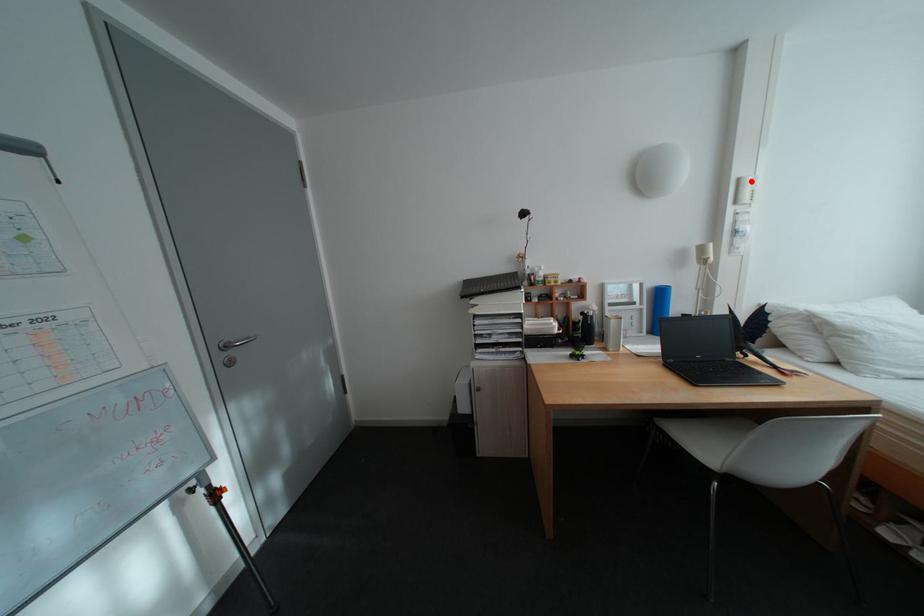
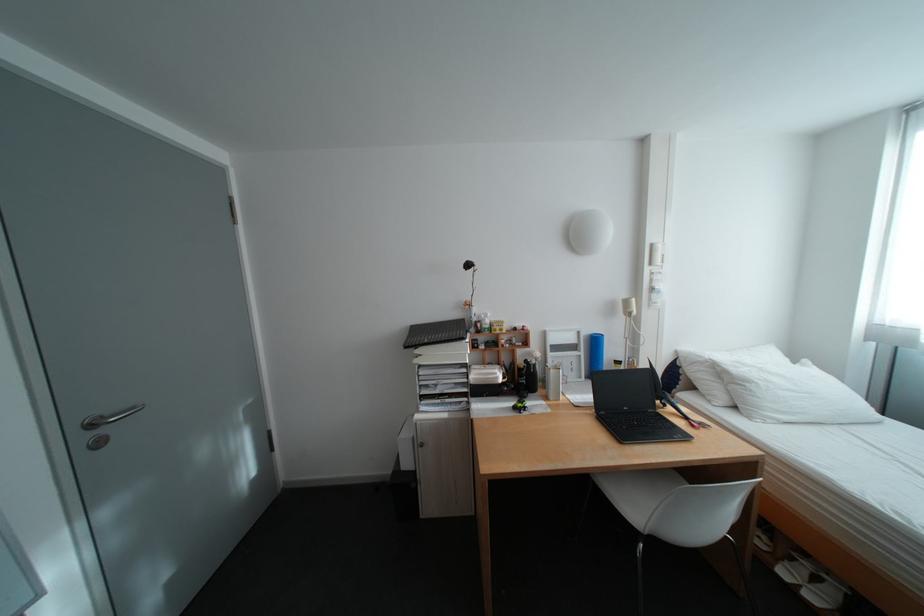
Locate, in the second image, the point that corresponds to the highlighted location in the first image.

(664, 246)